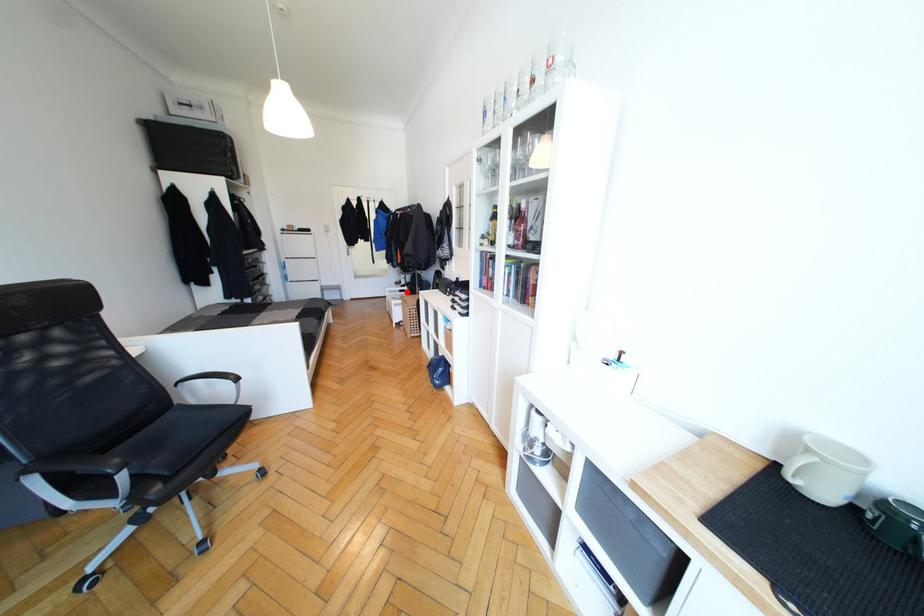
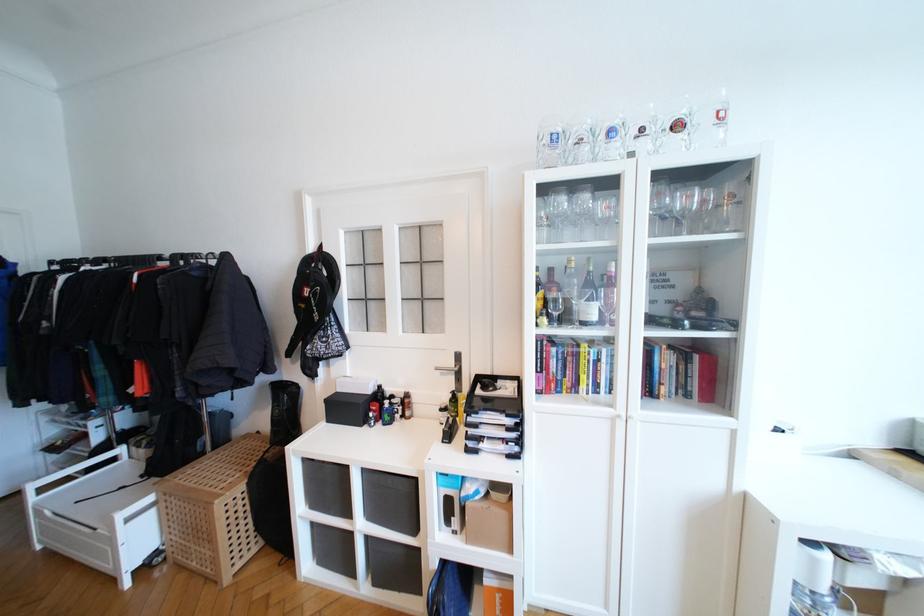
In the second image, find the point that corresponds to the highlighted location in the first image.

(116, 461)